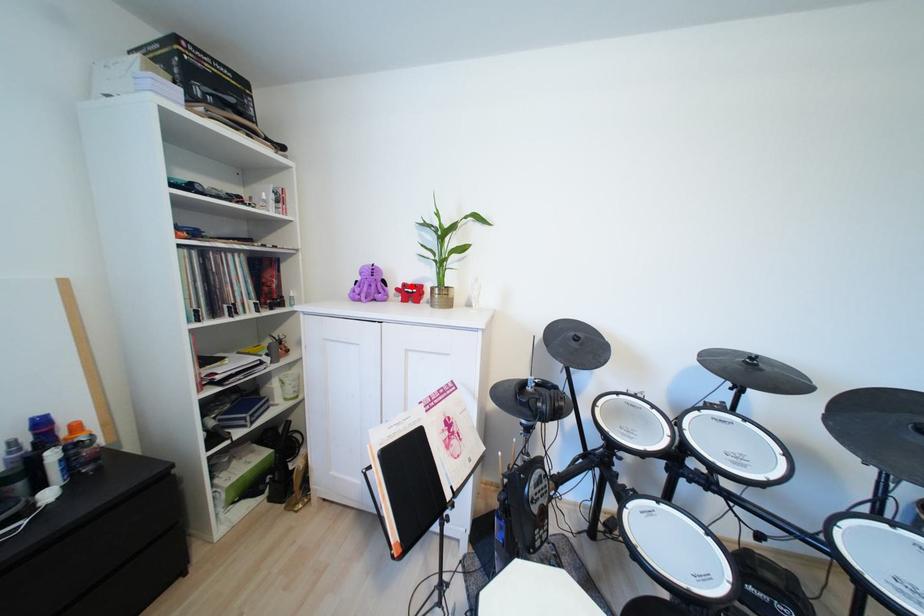
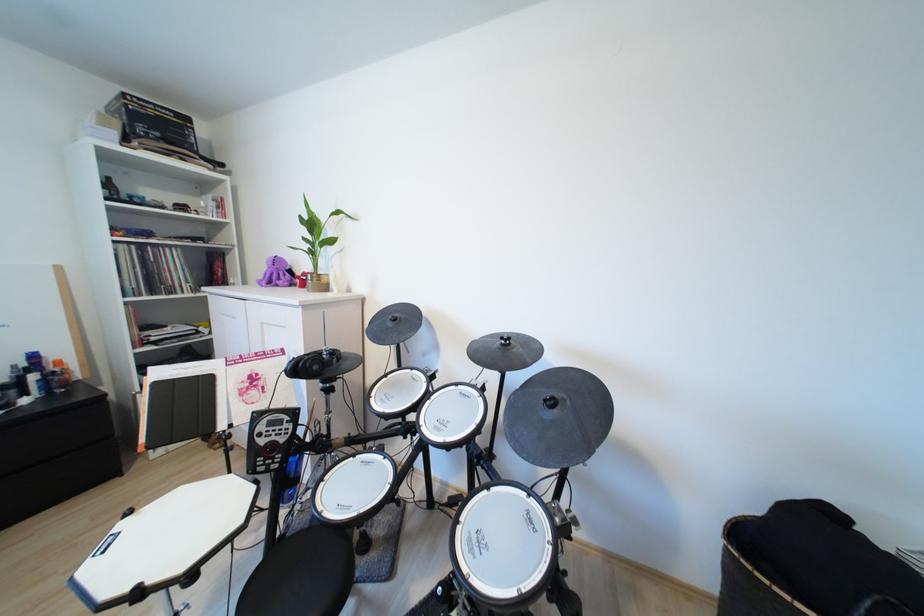
In the second image, find the point that corresponds to the highlighted location in the first image.

(310, 275)